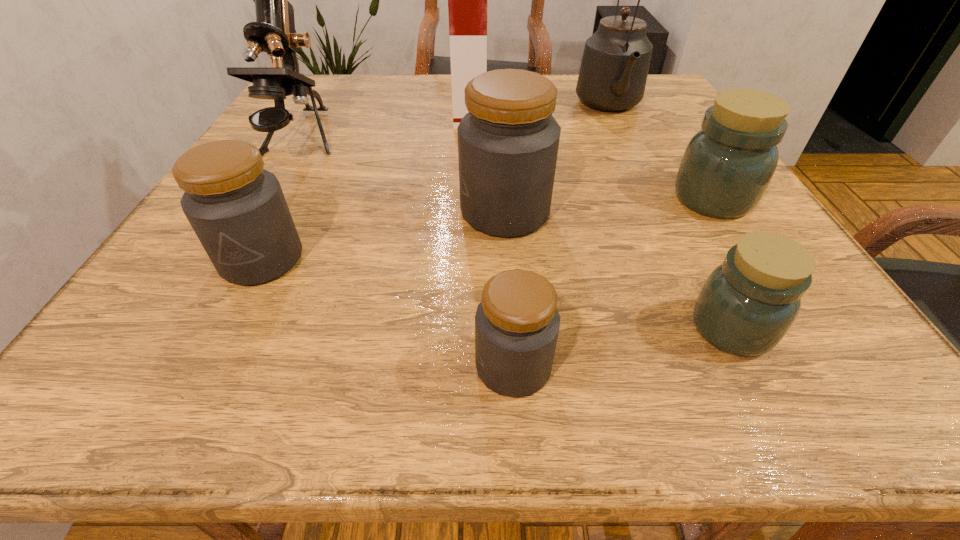
Locate an element on the screen. The image size is (960, 540). free space located through the eyepiece of the microscope is located at coordinates (239, 249).

At what (x,y) coordinates should I click in order to perform the action: click on free region located 0.370m on the front-facing side of the red cigarette_case. Please return your answer as a coordinate pair (x, y). Looking at the image, I should click on (637, 107).

Identify the location of vacant space located 0.050m spout on the kettle. Image resolution: width=960 pixels, height=540 pixels. (626, 141).

Locate an element on the screen. The height and width of the screenshot is (540, 960). free space located 0.300m on the surface of the tallest jar near the warning symbol is located at coordinates (290, 212).

Locate an element on the screen. free space located 0.220m on the surface of the tallest jar near the warning symbol is located at coordinates (335, 212).

At what (x,y) coordinates should I click in order to perform the action: click on free region located 0.220m on the surface of the tallest jar near the warning symbol. Please return your answer as a coordinate pair (x, y). Image resolution: width=960 pixels, height=540 pixels. Looking at the image, I should click on (335, 212).

Locate an element on the screen. free space located 0.330m on the left of the bigger green jar is located at coordinates (492, 199).

Locate an element on the screen. vacant space located 0.150m on the surface of the leftmost jar near the warning symbol is located at coordinates (202, 378).

Find the location of `free space located on the left of the smaller green jar`. free space located on the left of the smaller green jar is located at coordinates (527, 328).

Where is `free space located 0.080m on the surface of the smallest gray jar near the warning symbol`? free space located 0.080m on the surface of the smallest gray jar near the warning symbol is located at coordinates (411, 366).